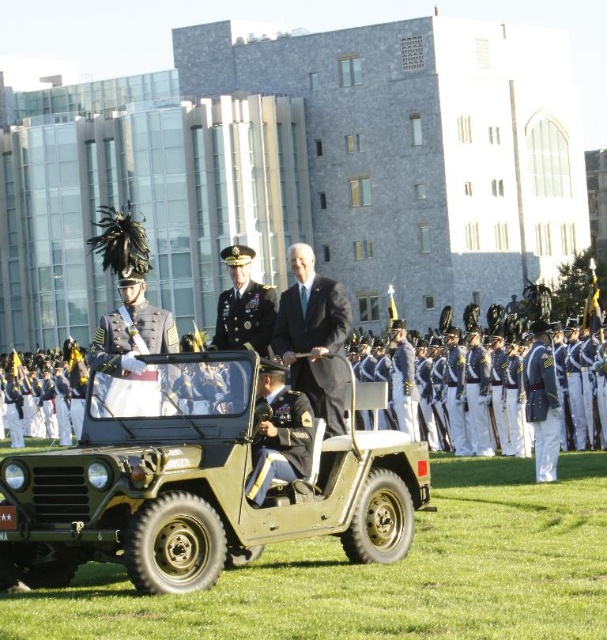
In the scene shown: You are a photographer positioned at the back of the parade area. You need to capture a closeup shot of both the dark blue fabric uniform at center and the shiny gold epaulets at center in the same frame. Considering their distance, will you be able to adjust your camera settings to focus on both objects clearly?

The dark blue fabric uniform at center is 16.78 meters from the shiny gold epalets at center. Since the distance between them is significant, it might be challenging to focus both clearly in a single closeup shot. You may need to use a smaller aperture to increase depth of field or adjust your position to reduce the distance between them in the frame.

Based on the photo, you are a photographer positioned at the back of the parade. You need to capture a photo of both the blue uniform at center and the black matte suit at center. Based on their positions, which one is closer to the camera?

The blue uniform at center is located below the black matte suit at center, meaning it is closer to the camera.

You are a photographer positioned at the back of the parade. You notice two points marked in the scene. Which point is closer to your camera, point 1 at coordinates point (x=426, y=392) or point 2 at coordinates point (x=279, y=458)?

Point 1 at coordinates point (x=426, y=392) is closer to the camera because it is further to the viewer than point 2 at coordinates point (x=279, y=458).